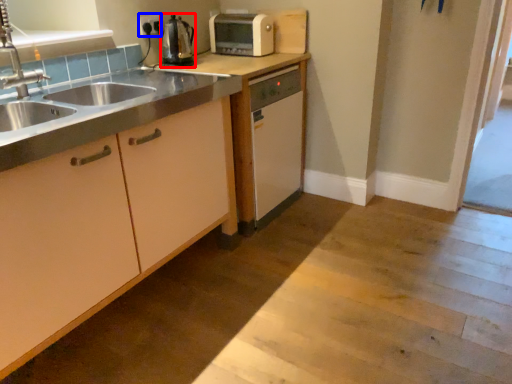
Question: Which object appears farthest to the camera in this image, kitchen appliance (highlighted by a red box) or electric outlet (highlighted by a blue box)?

Choices:
 (A) kitchen appliance
 (B) electric outlet

Answer: (B)